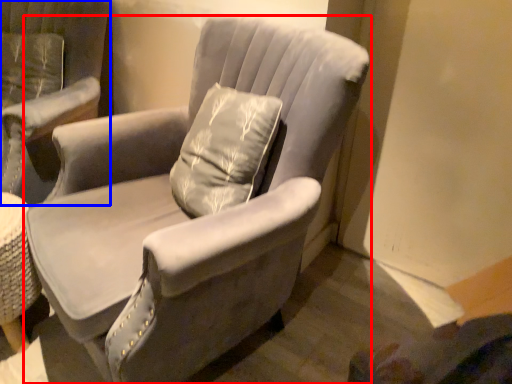
Question: Which object is closer to the camera taking this photo, chair (highlighted by a red box) or chair (highlighted by a blue box)?

Choices:
 (A) chair
 (B) chair

Answer: (A)